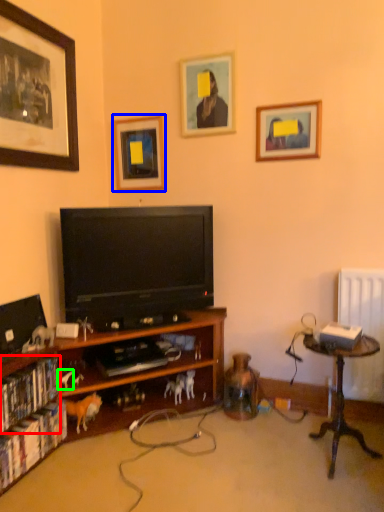
Question: Which object is positioned farthest from book (highlighted by a red box)? Select from picture frame (highlighted by a blue box) and animal (highlighted by a green box).

Choices:
 (A) picture frame
 (B) animal

Answer: (A)